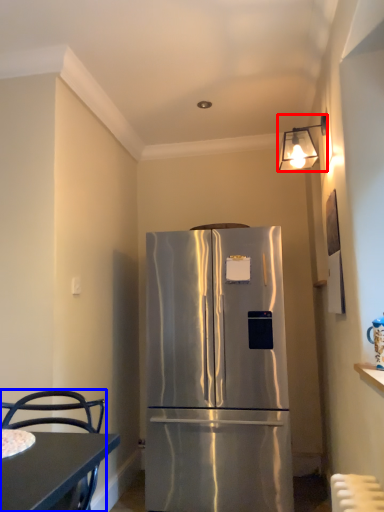
Question: Which point is further to the camera, lamp (highlighted by a red box) or chair (highlighted by a blue box)?

Choices:
 (A) lamp
 (B) chair

Answer: (A)